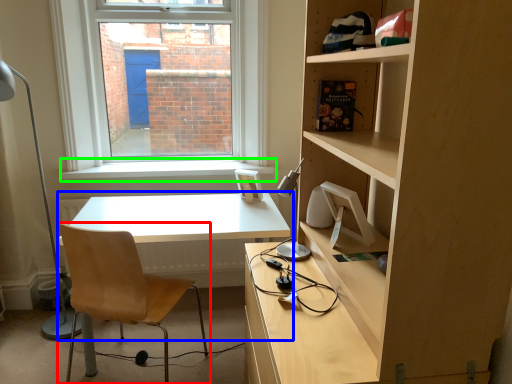
Question: Estimate the real-world distances between objects in this image. Which object is farther from chair (highlighted by a red box), table (highlighted by a blue box) or window sill (highlighted by a green box)?

Choices:
 (A) table
 (B) window sill

Answer: (B)